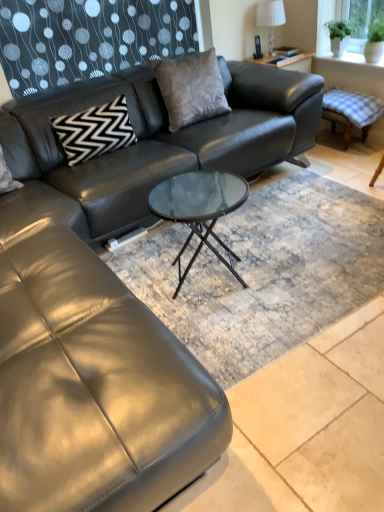
Question: Is black zigzag-patterned pillow at upper left, positioned as the 1th pillow in left-to-right order, positioned with its back to white fabric lampshade at upper right?

Choices:
 (A) yes
 (B) no

Answer: (B)

Question: Could white fabric lampshade at upper right be considered to be inside black zigzag-patterned pillow at upper left, marked as the 2th pillow in a right-to-left arrangement?

Choices:
 (A) yes
 (B) no

Answer: (B)

Question: Can you confirm if black zigzag-patterned pillow at upper left, positioned as the 1th pillow in left-to-right order, is bigger than white fabric lampshade at upper right?

Choices:
 (A) no
 (B) yes

Answer: (B)

Question: Is black zigzag-patterned pillow at upper left, positioned as the 1th pillow in left-to-right order, beside white fabric lampshade at upper right?

Choices:
 (A) yes
 (B) no

Answer: (B)

Question: From the image's perspective, is black zigzag-patterned pillow at upper left, marked as the 2th pillow in a right-to-left arrangement, located above white fabric lampshade at upper right?

Choices:
 (A) yes
 (B) no

Answer: (B)

Question: Can you confirm if black zigzag-patterned pillow at upper left, positioned as the 1th pillow in left-to-right order, is thinner than white fabric lampshade at upper right?

Choices:
 (A) yes
 (B) no

Answer: (A)

Question: From the image's perspective, is matte black side table at upper right located above white fabric lampshade at upper right?

Choices:
 (A) no
 (B) yes

Answer: (A)

Question: Considering the relative sizes of matte black side table at upper right and white fabric lampshade at upper right in the image provided, is matte black side table at upper right smaller than white fabric lampshade at upper right?

Choices:
 (A) yes
 (B) no

Answer: (A)

Question: Can white fabric lampshade at upper right be found inside matte black side table at upper right?

Choices:
 (A) no
 (B) yes

Answer: (A)

Question: Can you confirm if matte black side table at upper right is wider than white fabric lampshade at upper right?

Choices:
 (A) no
 (B) yes

Answer: (A)

Question: From a real-world perspective, is matte black side table at upper right located higher than white fabric lampshade at upper right?

Choices:
 (A) no
 (B) yes

Answer: (A)

Question: Is matte black side table at upper right closer to camera compared to white fabric lampshade at upper right?

Choices:
 (A) no
 (B) yes

Answer: (A)

Question: Can you confirm if checkered fabric swivel chair at right is taller than white fabric lampshade at upper right?

Choices:
 (A) no
 (B) yes

Answer: (A)